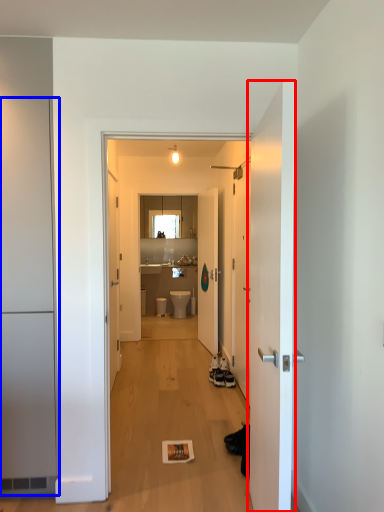
Question: Which object appears closest to the camera in this image, door (highlighted by a red box) or door (highlighted by a blue box)?

Choices:
 (A) door
 (B) door

Answer: (A)